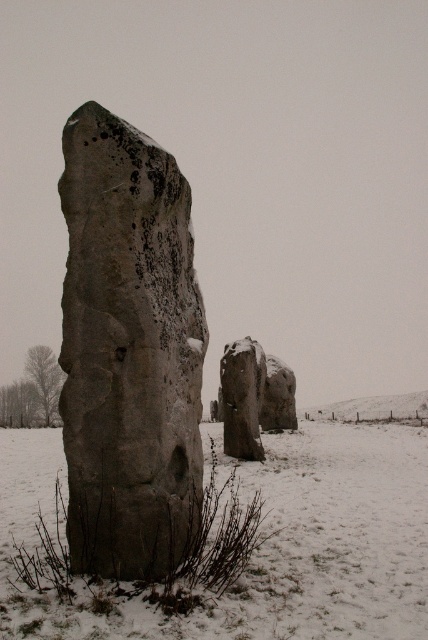
Which is in front, point (196, 435) or point (229, 374)?

Point (196, 435) is in front.

Is point (77, 134) in front of point (225, 372)?

Yes, point (77, 134) is closer to viewer.

I want to click on rough stone monolith at center, so click(128, 349).

Does gray stone monolith at left have a smaller size compared to smooth gray rock at center?

Incorrect, gray stone monolith at left is not smaller in size than smooth gray rock at center.

Which is behind, point (360, 460) or point (252, 445)?

Point (360, 460)

Is point (389, 580) behind point (261, 403)?

No, it is not.

Find the location of a particular element. gray stone monolith at left is located at coordinates (262, 544).

Is rough stone monolith at center taller than gray stone monolith at left?

Correct, rough stone monolith at center is much taller as gray stone monolith at left.

Looking at this image, does rough stone monolith at center appear on the right side of gray stone monolith at left?

Correct, you'll find rough stone monolith at center to the right of gray stone monolith at left.

Which is behind, point (187, 342) or point (409, 561)?

The point (409, 561) is behind.

Where is `rough stone monolith at center`? The image size is (428, 640). rough stone monolith at center is located at coordinates (128, 349).